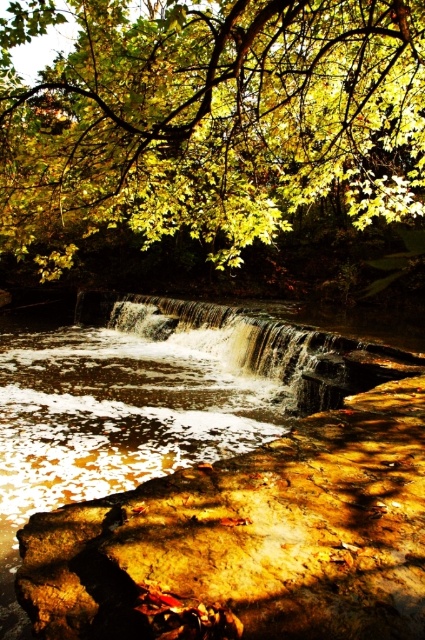
Question: Is yellow/golden leaves at upper center thinner than golden textured water at center?

Choices:
 (A) no
 (B) yes

Answer: (A)

Question: Can you confirm if yellow/golden leaves at upper center is positioned to the left of golden textured water at center?

Choices:
 (A) no
 (B) yes

Answer: (B)

Question: Which of the following is the farthest from the observer?

Choices:
 (A) golden textured water at center
 (B) yellow/golden leaves at upper center

Answer: (A)

Question: Does yellow/golden leaves at upper center have a lesser width compared to golden textured water at center?

Choices:
 (A) yes
 (B) no

Answer: (B)